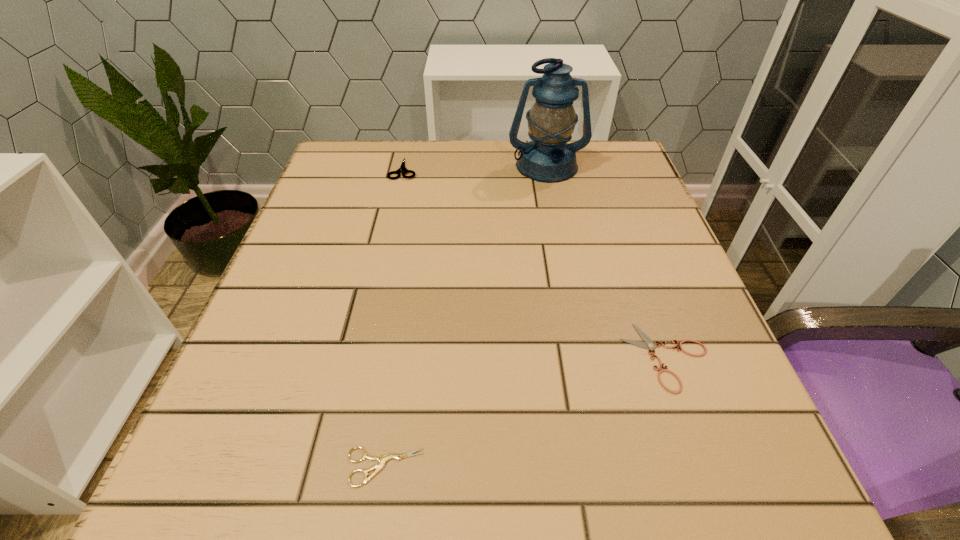
The image size is (960, 540). In order to click on vacant space at the left edge of the desktop in this screenshot , I will do `click(301, 248)`.

Identify the location of vacant space at the right edge of the desktop. (659, 395).

Locate an element on the screen. The image size is (960, 540). vacant area at the far left corner of the desktop is located at coordinates (332, 192).

Identify the location of free space at the near left corner of the desktop. (200, 495).

You are a GUI agent. You are given a task and a screenshot of the screen. Output one action in this format:
    pyautogui.click(x=<x>, y=<y>)
    Task: Click on the vacant region at the far right corner of the desktop
    The height and width of the screenshot is (540, 960).
    Given the screenshot: What is the action you would take?
    pyautogui.click(x=602, y=163)

Find the location of a particular element. vacant area that lies between the nearest shears and the tallest object is located at coordinates (466, 316).

In order to click on free space between the second nearest shears and the tallest object in this screenshot , I will do `click(607, 261)`.

Image resolution: width=960 pixels, height=540 pixels. I want to click on vacant area that lies between the lantern and the nearest object, so click(466, 316).

Where is `vacant area that lies between the tallest object and the nearest shears`? vacant area that lies between the tallest object and the nearest shears is located at coordinates (466, 316).

Locate an element on the screen. This screenshot has height=540, width=960. free area in between the lantern and the tallest shears is located at coordinates (475, 167).